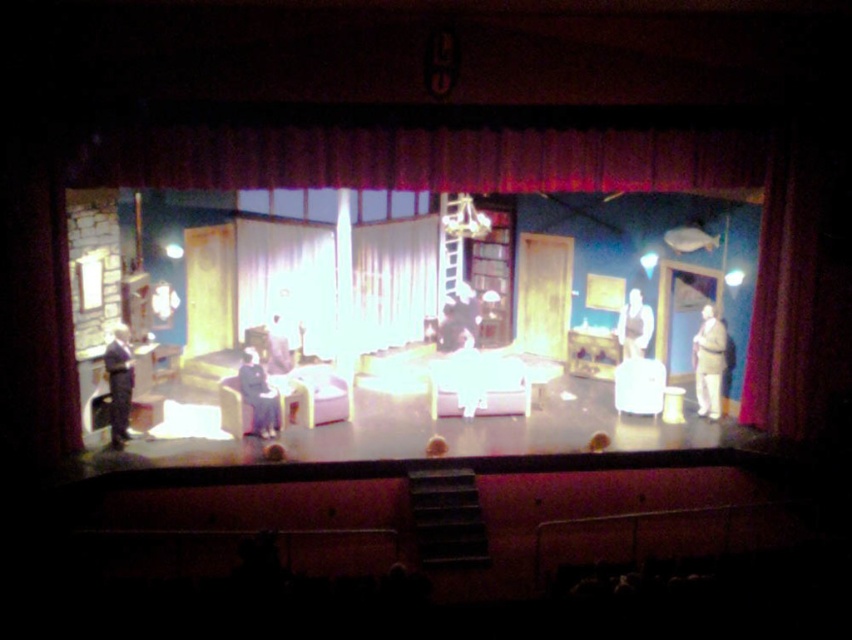
Does point (799, 358) come closer to viewer compared to point (275, 422)?

Yes, point (799, 358) is closer to viewer.

Is velvet red curtain at right to the right of dark blue suit at left from the viewer's perspective?

Yes, velvet red curtain at right is to the right of dark blue suit at left.

Which is behind, point (786, 225) or point (256, 353)?

Point (786, 225)

Locate an element on the screen. The image size is (852, 640). velvet red curtain at right is located at coordinates (783, 289).

Is white cotton shirt at right to the left of dark blue suit at left from the viewer's perspective?

In fact, white cotton shirt at right is to the right of dark blue suit at left.

Is point (712, 401) behind point (271, 428)?

Yes, point (712, 401) is farther from viewer.

Is point (711, 401) closer to viewer compared to point (255, 406)?

That is False.

Identify the location of white cotton shirt at right. This screenshot has width=852, height=640. (709, 362).

Is point (298, 268) less distant than point (773, 339)?

No, it is not.

Is point (384, 225) behind point (752, 353)?

Yes, it is behind point (752, 353).

At what (x,y) coordinates should I click in order to perform the action: click on white fabric curtain at center. Please return your answer as a coordinate pair (x, y). Looking at the image, I should click on (288, 280).